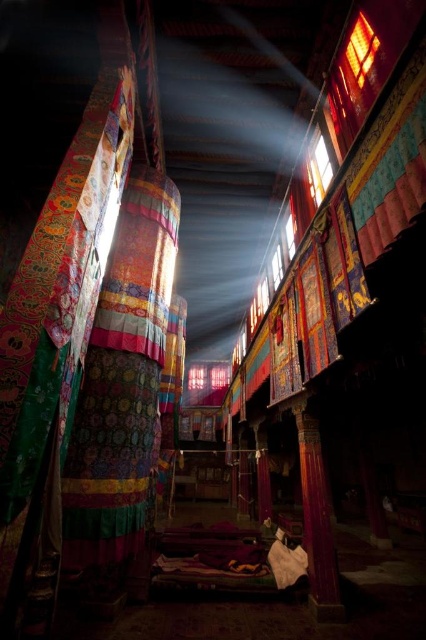
Is point (322, 611) more distant than point (348, 58)?

Yes, point (322, 611) is farther from viewer.

Which is below, purple fabric column at lower right or translucent glass window at upper center?

purple fabric column at lower right is below.

Locate an element on the screen. purple fabric column at lower right is located at coordinates (316, 520).

This screenshot has height=640, width=426. What are the coordinates of `purple fabric column at lower right` in the screenshot? It's located at (316, 520).